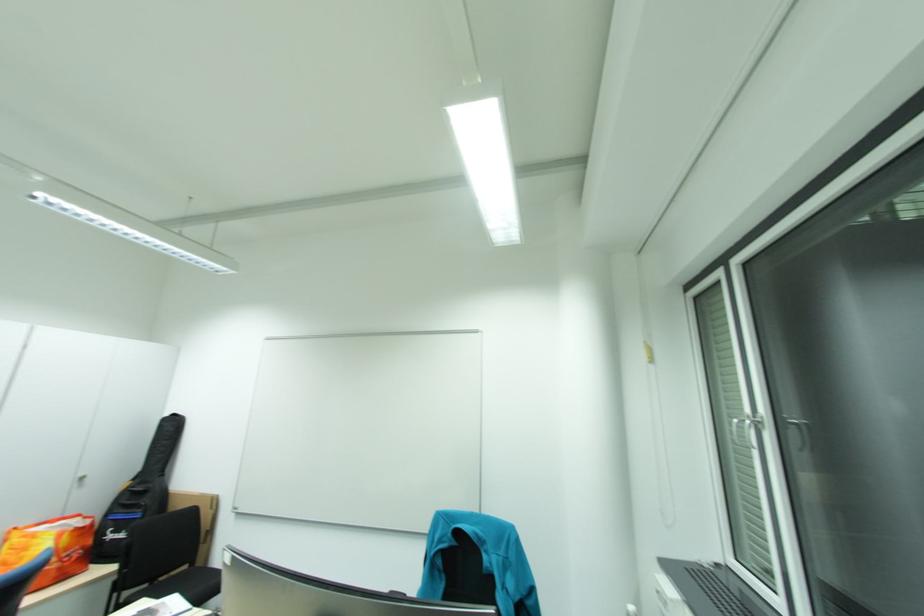
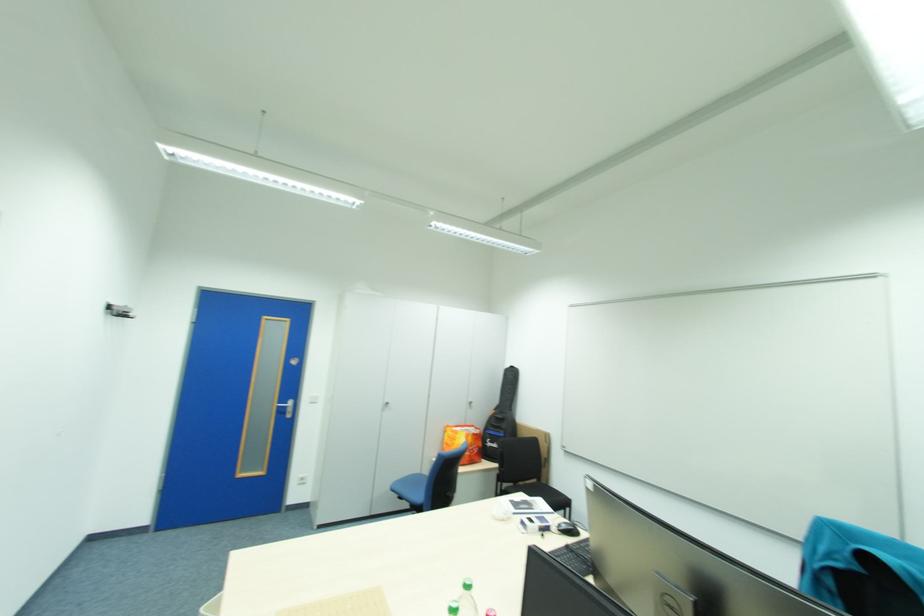
In the second image, find the point that corresponds to point (91, 479) in the first image.

(479, 403)